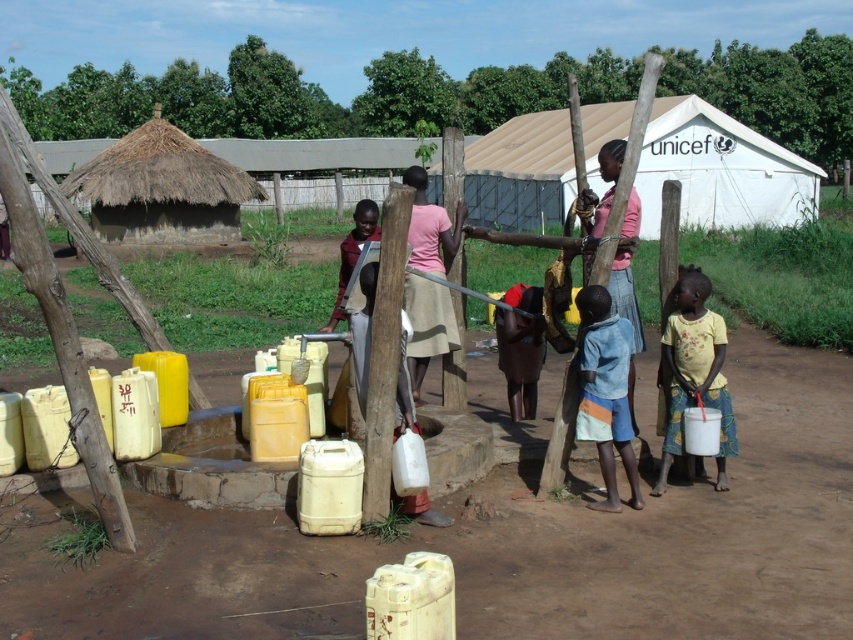
Question: Can you confirm if white canvas tent at upper center is wider than yellow fabric skirt at lower right?

Choices:
 (A) no
 (B) yes

Answer: (B)

Question: Observing the image, what is the correct spatial positioning of blue denim skirt at center in reference to pink matte skirt at center?

Choices:
 (A) above
 (B) below

Answer: (B)

Question: Which point is farther to the camera?

Choices:
 (A) pink matte skirt at center
 (B) white canvas tent at upper center
 (C) yellow fabric skirt at lower right
 (D) blue denim skirt at center

Answer: (C)

Question: Which object is the closest to the yellow fabric skirt at lower right?

Choices:
 (A) white canvas tent at upper center
 (B) blue denim skirt at center

Answer: (B)

Question: Which of the following is the closest to the observer?

Choices:
 (A) (604, 328)
 (B) (668, 436)
 (C) (671, 108)

Answer: (A)

Question: Does white canvas tent at upper center appear over blue denim skirt at center?

Choices:
 (A) no
 (B) yes

Answer: (B)